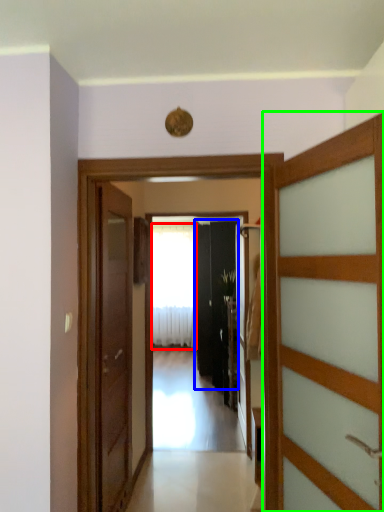
Question: Based on their relative distances, which object is nearer to curtain (highlighted by a red box)? Choose from door (highlighted by a blue box) and door (highlighted by a green box).

Choices:
 (A) door
 (B) door

Answer: (A)